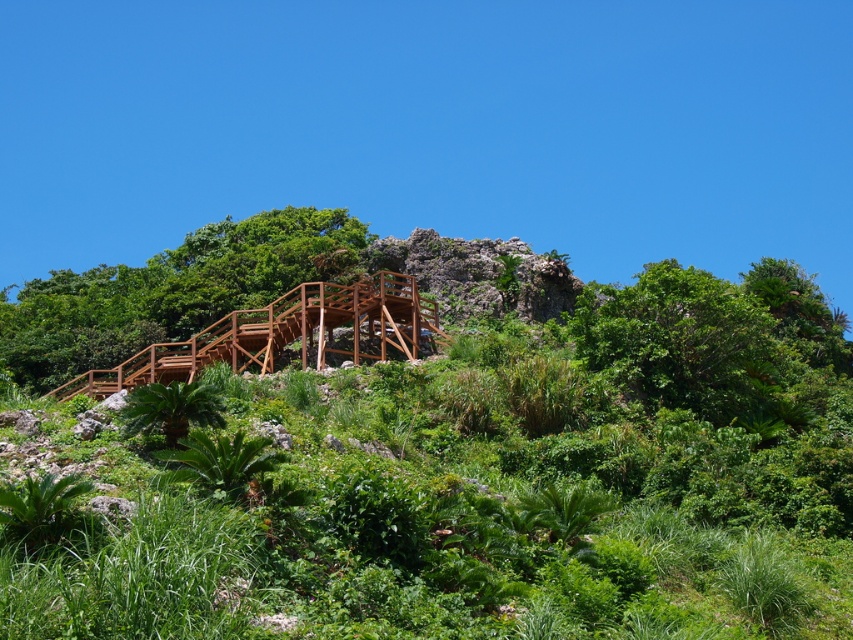
Question: Which of the following is the farthest from the observer?

Choices:
 (A) green leafy plant at lower left
 (B) brown wooden staircase at upper center

Answer: (B)

Question: Does brown wooden staircase at upper center have a greater width compared to green leafy plant at lower left?

Choices:
 (A) no
 (B) yes

Answer: (B)

Question: Is brown wooden staircase at upper center positioned behind green leafy plant at lower left?

Choices:
 (A) no
 (B) yes

Answer: (B)

Question: Does brown wooden staircase at upper center appear on the left side of green leafy plant at lower left?

Choices:
 (A) yes
 (B) no

Answer: (A)